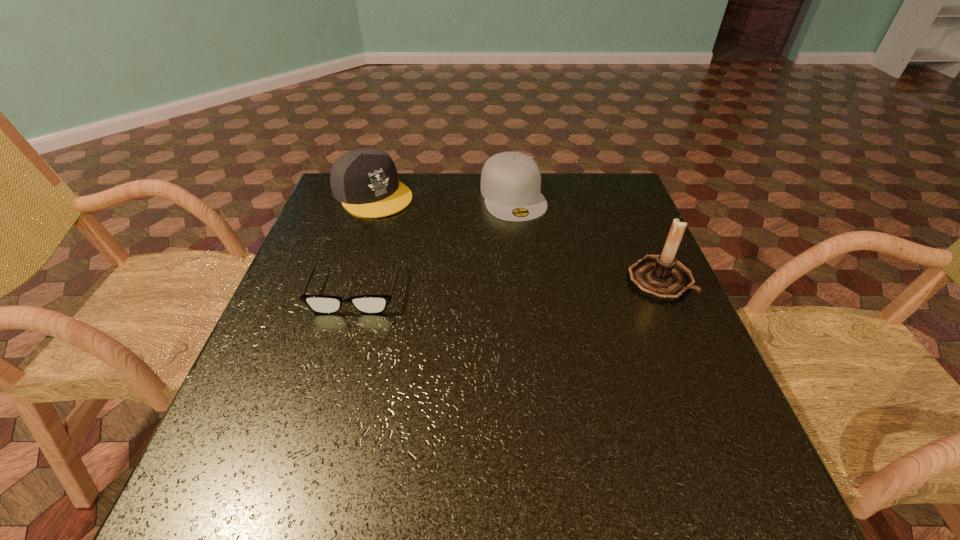
The image size is (960, 540). Identify the location of the shortest object. (322, 304).

Locate an element on the screen. This screenshot has height=540, width=960. candle holder is located at coordinates (661, 277).

Where is `the tallest object`? This screenshot has height=540, width=960. the tallest object is located at coordinates (661, 277).

At what (x,y) coordinates should I click in order to perform the action: click on the second object from right to left. Please return your answer as a coordinate pair (x, y). The width and height of the screenshot is (960, 540). Looking at the image, I should click on (510, 181).

The width and height of the screenshot is (960, 540). I want to click on the left cap, so click(x=365, y=181).

Locate an element on the screen. The image size is (960, 540). vacant space located 0.270m on the front-facing side of the spectacles is located at coordinates (315, 431).

Locate an element on the screen. free space located 0.160m on the back of the rightmost object is located at coordinates (635, 221).

I want to click on free space located 0.270m on the front-facing side of the third object from left to right, so click(x=551, y=289).

Identify the location of vacant point located on the front-facing side of the third object from left to right. (540, 261).

At what (x,y) coordinates should I click in order to perform the action: click on vacant area situated on the front-facing side of the third object from left to right. Please return your answer as a coordinate pair (x, y). Looking at the image, I should click on (533, 246).